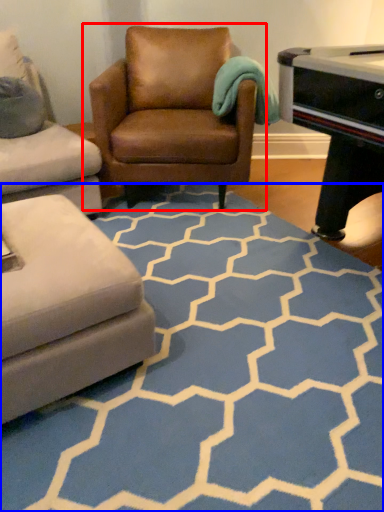
Question: Among these objects, which one is nearest to the camera, chair (highlighted by a red box) or pattern (highlighted by a blue box)?

Choices:
 (A) chair
 (B) pattern

Answer: (B)